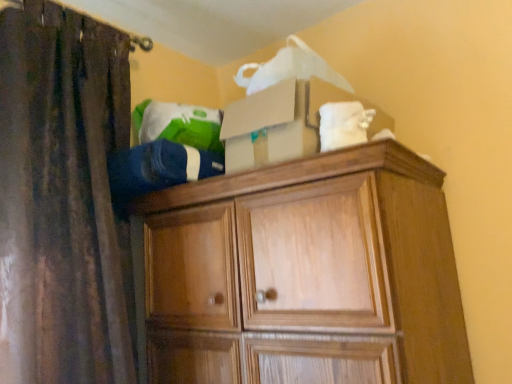
Question: Can you confirm if brown fabric curtain at left is positioned to the left of blue fleece jacket at upper center, the 1th clothing from the left?

Choices:
 (A) yes
 (B) no

Answer: (A)

Question: Is brown fabric curtain at left not close to blue fleece jacket at upper center, the 1th clothing from the left?

Choices:
 (A) yes
 (B) no

Answer: (B)

Question: Would you say brown fabric curtain at left contains blue fleece jacket at upper center, the 1th clothing from the left?

Choices:
 (A) no
 (B) yes

Answer: (B)

Question: Is brown fabric curtain at left beside blue fleece jacket at upper center, the 2th clothing when ordered from right to left?

Choices:
 (A) yes
 (B) no

Answer: (B)

Question: From a real-world perspective, is brown fabric curtain at left located higher than blue fleece jacket at upper center, the 1th clothing from the left?

Choices:
 (A) no
 (B) yes

Answer: (A)

Question: Could you tell me if brown fabric curtain at left is facing blue fleece jacket at upper center, the 2th clothing when ordered from right to left?

Choices:
 (A) yes
 (B) no

Answer: (B)

Question: Can you confirm if blue fleece jacket at upper center, the 1th clothing from the left, is positioned to the left of white fabric at upper right, marked as the 1th clothing in a right-to-left arrangement?

Choices:
 (A) no
 (B) yes

Answer: (B)

Question: Is blue fleece jacket at upper center, the 1th clothing from the left, surrounding white fabric at upper right, marked as the 1th clothing in a right-to-left arrangement?

Choices:
 (A) yes
 (B) no

Answer: (B)

Question: Can you confirm if blue fleece jacket at upper center, the 1th clothing from the left, is bigger than white fabric at upper right, marked as the 1th clothing in a right-to-left arrangement?

Choices:
 (A) yes
 (B) no

Answer: (A)

Question: Considering the relative sizes of blue fleece jacket at upper center, the 2th clothing when ordered from right to left, and white fabric at upper right, marked as the 1th clothing in a right-to-left arrangement, in the image provided, is blue fleece jacket at upper center, the 2th clothing when ordered from right to left, wider than white fabric at upper right, marked as the 1th clothing in a right-to-left arrangement,?

Choices:
 (A) yes
 (B) no

Answer: (A)

Question: Is white fabric at upper right, marked as the 1th clothing in a right-to-left arrangement, at the back of blue fleece jacket at upper center, the 1th clothing from the left?

Choices:
 (A) yes
 (B) no

Answer: (B)

Question: Is blue fleece jacket at upper center, the 1th clothing from the left, oriented towards white fabric at upper right, acting as the 2th clothing starting from the left?

Choices:
 (A) yes
 (B) no

Answer: (B)

Question: Does white fabric at upper right, marked as the 1th clothing in a right-to-left arrangement, come in front of wooden cabinet at upper center?

Choices:
 (A) yes
 (B) no

Answer: (B)